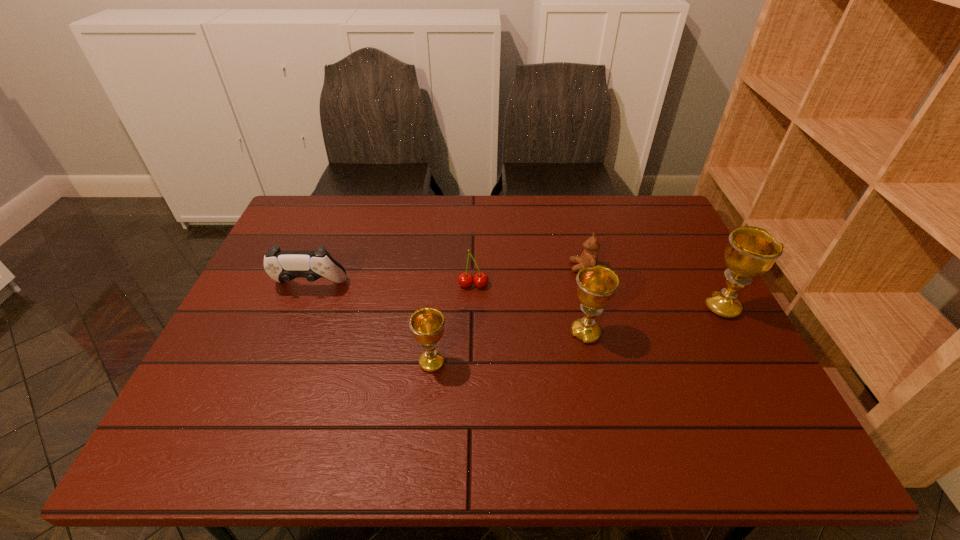
The height and width of the screenshot is (540, 960). I want to click on empty space between the fifth object from right to left and the teddy bear, so click(507, 314).

Image resolution: width=960 pixels, height=540 pixels. Identify the location of free spot between the teddy bear and the leftmost object. (446, 276).

Locate an element on the screen. This screenshot has height=540, width=960. free spot between the leftmost object and the nearest chalice is located at coordinates (371, 324).

The height and width of the screenshot is (540, 960). In order to click on the fourth closest object to the control in this screenshot , I will do `click(589, 258)`.

Locate which object is the fourth closest to the cherry. Please provide its 2D coordinates. Your answer should be formatted as a tuple, i.e. [(x, y)], where the tuple contains the x and y coordinates of a point satisfying the conditions above.

[(282, 266)]

Locate an element on the screen. Image resolution: width=960 pixels, height=540 pixels. chalice that can be found as the third closest to the cherry is located at coordinates (751, 251).

I want to click on chalice that is the nearest to the cherry, so click(x=427, y=324).

Find the location of a particular element. free region that satisfies the following two spatial constraints: 1. with the stems of the second tallest object pointing upwards; 2. on the right side of the third object from left to right is located at coordinates (472, 333).

Identify the location of vacant area in the image that satisfies the following two spatial constraints: 1. on the face of the teddy bear; 2. on the front-facing side of the leftmost object. (588, 286).

Identify the location of vacant space that satisfies the following two spatial constraints: 1. on the front-facing side of the second chalice from right to left; 2. on the right side of the leftmost object. This screenshot has width=960, height=540. (290, 333).